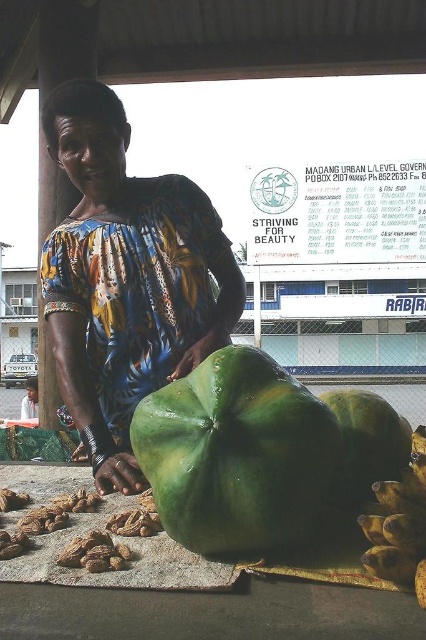
Describe the element at coordinates (236, 454) in the screenshot. The image size is (426, 640). I see `green matte fruit at center` at that location.

Is green matte fruit at center above yellow-green textured bananas at lower right?

Yes, green matte fruit at center is above yellow-green textured bananas at lower right.

What do you see at coordinates (236, 454) in the screenshot?
I see `green matte fruit at center` at bounding box center [236, 454].

Find the location of a particular element. green matte fruit at center is located at coordinates (236, 454).

The height and width of the screenshot is (640, 426). What do you see at coordinates (126, 278) in the screenshot? I see `printed fabric woman at center` at bounding box center [126, 278].

Image resolution: width=426 pixels, height=640 pixels. I want to click on printed fabric woman at center, so click(x=126, y=278).

Describe the element at coordinates (236, 454) in the screenshot. I see `green matte fruit at center` at that location.

In the scene shown: Is green matte fruit at center below green matte papaya at center?

Indeed, green matte fruit at center is positioned under green matte papaya at center.

Who is more forward, [192,384] or [367,440]?

Point [192,384] is more forward.

At what (x,y) coordinates should I click in order to perform the action: click on green matte fruit at center. Please return your answer as a coordinate pair (x, y). This screenshot has height=640, width=426. Looking at the image, I should click on (236, 454).